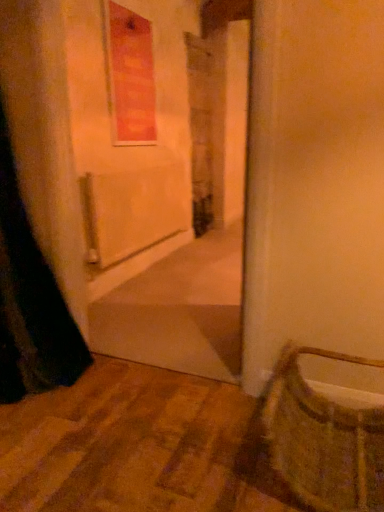
What do you see at coordinates (130, 75) in the screenshot? The image size is (384, 512). I see `matte orange window at upper center` at bounding box center [130, 75].

Where is `matte orange window at upper center`? The height and width of the screenshot is (512, 384). matte orange window at upper center is located at coordinates (130, 75).

What do you see at coordinates (324, 438) in the screenshot?
I see `woven straw basket at lower right` at bounding box center [324, 438].

Where is `woven straw basket at lower right`? woven straw basket at lower right is located at coordinates (324, 438).

Locate an element on the screen. The width and height of the screenshot is (384, 512). matte orange window at upper center is located at coordinates (130, 75).

Does woven straw basket at lower right appear on the left side of matte orange window at upper center?

No, woven straw basket at lower right is not to the left of matte orange window at upper center.

Does woven straw basket at lower right lie in front of matte orange window at upper center?

Yes, woven straw basket at lower right is in front of matte orange window at upper center.

Which is closer to the camera, (x=330, y=505) or (x=141, y=37)?

Point (x=330, y=505) appears to be closer to the viewer than point (x=141, y=37).

From the image's perspective, is woven straw basket at lower right located above or below matte orange window at upper center?

Clearly, from the image's perspective, woven straw basket at lower right is below matte orange window at upper center.

From a real-world perspective, is woven straw basket at lower right positioned over matte orange window at upper center based on gravity?

No.

Is woven straw basket at lower right wider or thinner than matte orange window at upper center?

Clearly, woven straw basket at lower right has more width compared to matte orange window at upper center.

Considering the relative sizes of woven straw basket at lower right and matte orange window at upper center in the image provided, is woven straw basket at lower right shorter than matte orange window at upper center?

Indeed, woven straw basket at lower right has a lesser height compared to matte orange window at upper center.

In terms of size, does woven straw basket at lower right appear bigger or smaller than matte orange window at upper center?

In the image, woven straw basket at lower right appears to be larger than matte orange window at upper center.

Looking at this image, is woven straw basket at lower right spatially inside matte orange window at upper center, or outside of it?

woven straw basket at lower right cannot be found inside matte orange window at upper center.

Is woven straw basket at lower right beside matte orange window at upper center?

They are not placed beside each other.

Could you tell me if woven straw basket at lower right is turned towards matte orange window at upper center?

No, woven straw basket at lower right is not facing towards matte orange window at upper center.

How many degrees apart are the facing directions of woven straw basket at lower right and matte orange window at upper center?

They differ by 90 degrees in their facing directions.

Where is `window behind the woven straw basket at lower right`? window behind the woven straw basket at lower right is located at coordinates click(130, 75).

Is matte orange window at upper center at the left side of woven straw basket at lower right?

Yes, matte orange window at upper center is to the left of woven straw basket at lower right.

Consider the image. Is the position of matte orange window at upper center more distant than that of woven straw basket at lower right?

Yes, it is.

Which is behind, point (117, 40) or point (357, 436)?

The point (117, 40) is farther from the camera.

From the image's perspective, would you say matte orange window at upper center is positioned over woven straw basket at lower right?

Indeed, from the image's perspective, matte orange window at upper center is shown above woven straw basket at lower right.

From a real-world perspective, which object stands above the other?

matte orange window at upper center.

Considering the sizes of objects matte orange window at upper center and woven straw basket at lower right in the image provided, who is thinner, matte orange window at upper center or woven straw basket at lower right?

matte orange window at upper center.

From their relative heights in the image, would you say matte orange window at upper center is taller or shorter than woven straw basket at lower right?

Clearly, matte orange window at upper center is taller compared to woven straw basket at lower right.

Between matte orange window at upper center and woven straw basket at lower right, which one has larger size?

Bigger between the two is woven straw basket at lower right.

Is matte orange window at upper center spatially inside woven straw basket at lower right, or outside of it?

matte orange window at upper center cannot be found inside woven straw basket at lower right.

Based on the photo, are matte orange window at upper center and woven straw basket at lower right beside each other?

No, matte orange window at upper center is not beside woven straw basket at lower right.

Could you tell me if matte orange window at upper center is turned towards woven straw basket at lower right?

A: No, matte orange window at upper center does not turn towards woven straw basket at lower right.

What's the angular difference between matte orange window at upper center and woven straw basket at lower right's facing directions?

There is a 90-degree angle between the facing directions of matte orange window at upper center and woven straw basket at lower right.

In the scene shown: How much distance is there between matte orange window at upper center and woven straw basket at lower right?

matte orange window at upper center and woven straw basket at lower right are 7.08 feet apart.

Where is `basket on the right of the matte orange window at upper center`? This screenshot has width=384, height=512. basket on the right of the matte orange window at upper center is located at coordinates (324, 438).

Image resolution: width=384 pixels, height=512 pixels. What are the coordinates of `basket below the matte orange window at upper center (from the image's perspective)` in the screenshot? It's located at (324, 438).

The height and width of the screenshot is (512, 384). I want to click on window above the woven straw basket at lower right (from a real-world perspective), so click(x=130, y=75).